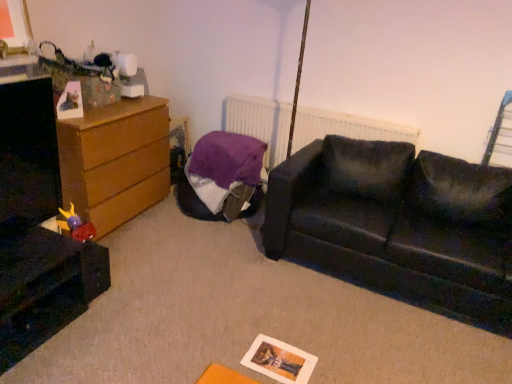
Question: Is point (x=490, y=132) positioned closer to the camera than point (x=233, y=105)?

Choices:
 (A) farther
 (B) closer

Answer: (B)

Question: Is metallic silver swivel chair at upper right in front of or behind white matte radiator at upper center in the image?

Choices:
 (A) behind
 (B) front

Answer: (B)

Question: Considering the real-world distances, which object is farthest from the metallic silver swivel chair at upper right?

Choices:
 (A) black glossy file cabinet at lower left
 (B) plush purple toy at lower left
 (C) white matte radiator at upper center
 (D) wooden chest of drawers at left
 (E) purple fabric bean bag at center

Answer: (A)

Question: Which of these objects is positioned farthest from the metallic silver swivel chair at upper right?

Choices:
 (A) wooden chest of drawers at left
 (B) plush purple toy at lower left
 (C) purple fabric bean bag at center
 (D) white matte radiator at upper center
 (E) black leather couch at center

Answer: (B)